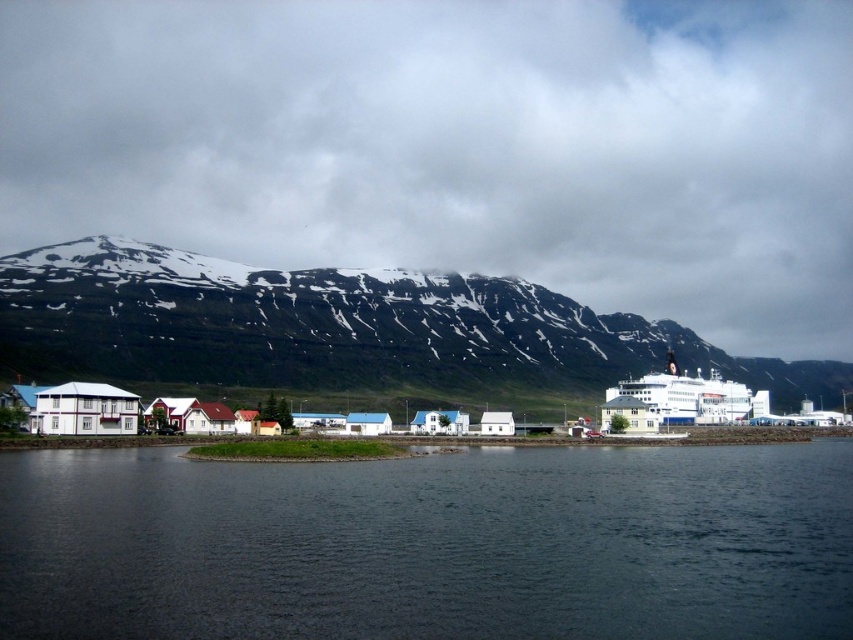
You are a photographer standing in the coastal town and want to capture a shot of the dark blue water at center and the white fluffy cloud at upper center. Based on their positions, which object is located to the right side of the other?

The white fluffy cloud at upper center is located to the right of the dark blue water at center.

In the scene shown: You are standing on a cliff overlooking the dark blue water at center and the green grassy mountain at upper center. Which object appears taller from your vantage point?

The green grassy mountain at upper center appears taller than the dark blue water at center because the description states that the dark blue water at center is not as tall as the green grassy mountain at upper center.

You are standing at the center of the coastal town and looking towards the mountain range. There is a white fluffy cloud at upper center marked by point (457, 145). Which direction should you turn to face the white fluffy cloud at upper center?

The white fluffy cloud at upper center is located at point (457, 145), which is directly above the center of the image. Therefore, you should look straight ahead to face the white fluffy cloud at upper center.